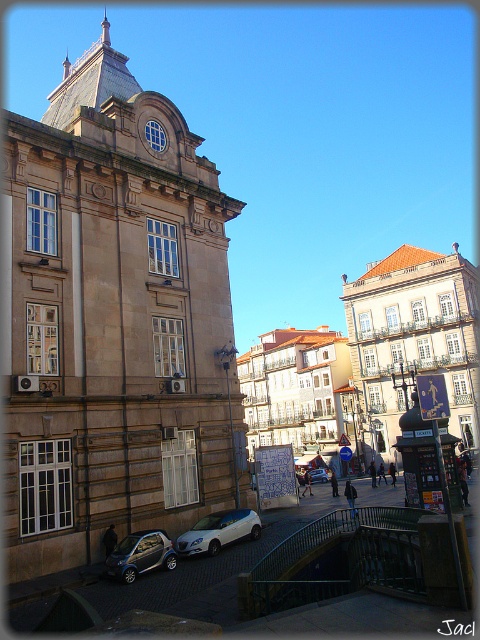
Between brown stone building at center and white matte car at center, which one appears on the right side from the viewer's perspective?

white matte car at center

Locate an element on the screen. This screenshot has height=640, width=480. brown stone building at center is located at coordinates (113, 321).

Is white matte hatchback at center closer to the viewer compared to shiny silver car at lower left?

That is False.

Can you confirm if white matte hatchback at center is shorter than shiny silver car at lower left?

Yes.

Is point (228, 509) positioned in front of point (172, 557)?

No, (228, 509) is behind (172, 557).

The width and height of the screenshot is (480, 640). Find the location of `white matte hatchback at center`. white matte hatchback at center is located at coordinates point(218,531).

Who is positioned more to the left, shiny silver car at lower left or white matte car at center?

From the viewer's perspective, shiny silver car at lower left appears more on the left side.

Does shiny silver car at lower left have a smaller size compared to white matte car at center?

Yes.

Who is more distant from viewer, (165,554) or (326,476)?

The point (326,476) is more distant.

The height and width of the screenshot is (640, 480). Identify the location of shiny silver car at lower left. (140, 556).